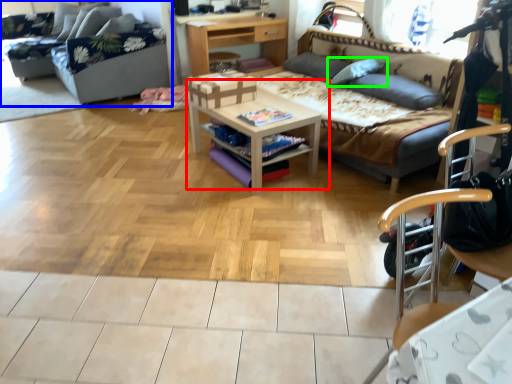
Question: Estimate the real-world distances between objects in this image. Which object is farther from table (highlighted by a red box), studio couch (highlighted by a blue box) or pillow (highlighted by a green box)?

Choices:
 (A) studio couch
 (B) pillow

Answer: (A)